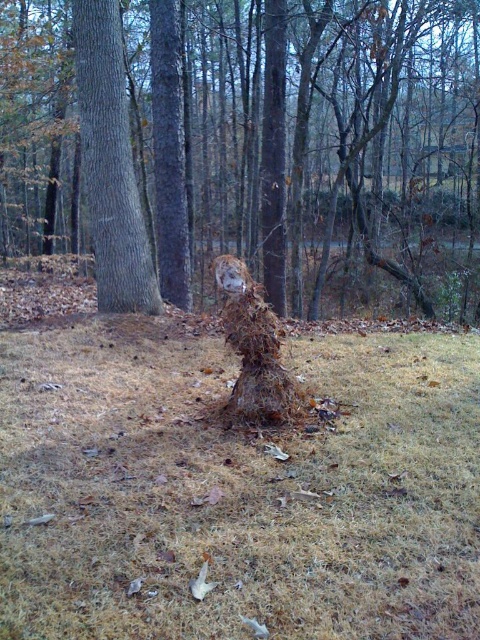
Which is more to the left, brown dry grass at center or brown rough tree trunk at left?

From the viewer's perspective, brown rough tree trunk at left appears more on the left side.

Identify the location of brown dry grass at center. (237, 490).

Who is more forward, (x=202, y=436) or (x=108, y=115)?

Point (x=202, y=436) is in front.

Where is `brown dry grass at center`? The height and width of the screenshot is (640, 480). brown dry grass at center is located at coordinates (237, 490).

Between brown textured tree stump at center and brown rough tree trunk at left, which one is positioned lower?

Positioned lower is brown rough tree trunk at left.

Is point (338, 134) positioned behind point (156, 288)?

Yes, point (338, 134) is farther from viewer.

Is point (252, 93) in front of point (107, 76)?

That is False.

This screenshot has width=480, height=640. I want to click on brown textured tree stump at center, so click(310, 145).

Measure the distance from brown textured tree stump at center to brown textured stump at center.

brown textured tree stump at center and brown textured stump at center are 33.30 feet apart from each other.

Which is more to the left, brown textured tree stump at center or brown textured stump at center?

From the viewer's perspective, brown textured tree stump at center appears more on the left side.

Between point (290, 186) and point (236, 316), which one is positioned in front?

Positioned in front is point (236, 316).

Image resolution: width=480 pixels, height=640 pixels. I want to click on brown textured tree stump at center, so click(x=310, y=145).